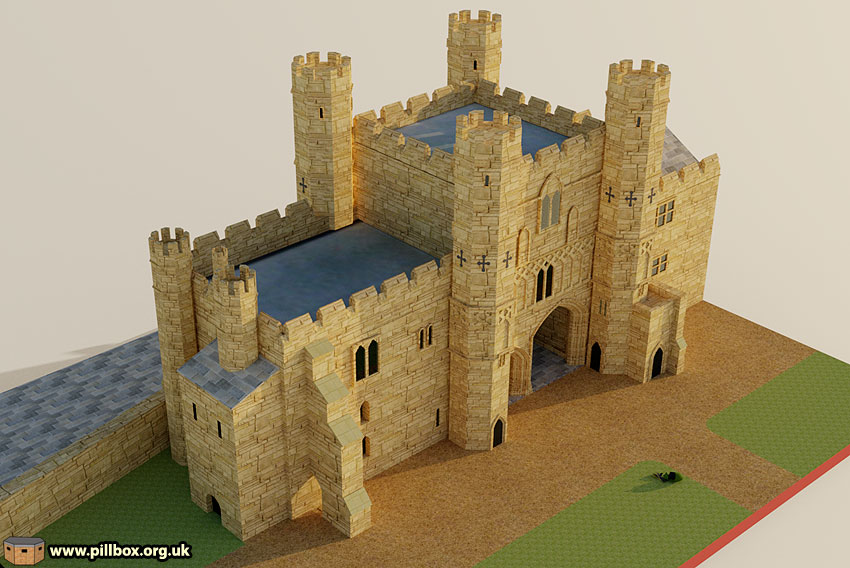
Find the location of a particular element. windows is located at coordinates [360, 360], [371, 358], [537, 289], [551, 288], [658, 219].